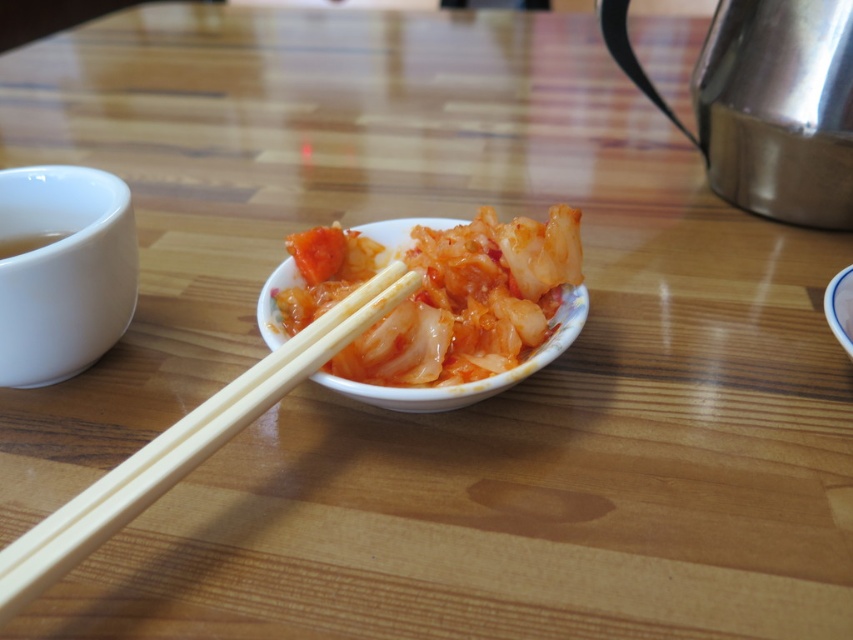
Question: Which point is farther from the camera taking this photo?

Choices:
 (A) (424, 266)
 (B) (328, 332)
 (C) (711, 132)

Answer: (C)

Question: Which object is positioned closest to the shiny metallic kettle at upper right?

Choices:
 (A) white glossy bowl at center
 (B) shiny orange kimchi at center

Answer: (A)

Question: Which point appears closest to the camera in this image?

Choices:
 (A) (305, 244)
 (B) (49, 349)
 (C) (282, 356)
 (D) (730, 97)

Answer: (C)

Question: Is the position of wooden chopsticks at center more distant than that of white glossy bowl at center?

Choices:
 (A) no
 (B) yes

Answer: (A)

Question: Is shiny metallic kettle at upper right to the left of shiny orange kimchi at center from the viewer's perspective?

Choices:
 (A) no
 (B) yes

Answer: (A)

Question: Does shiny metallic kettle at upper right appear on the right side of white ceramic bowl at left?

Choices:
 (A) no
 (B) yes

Answer: (B)